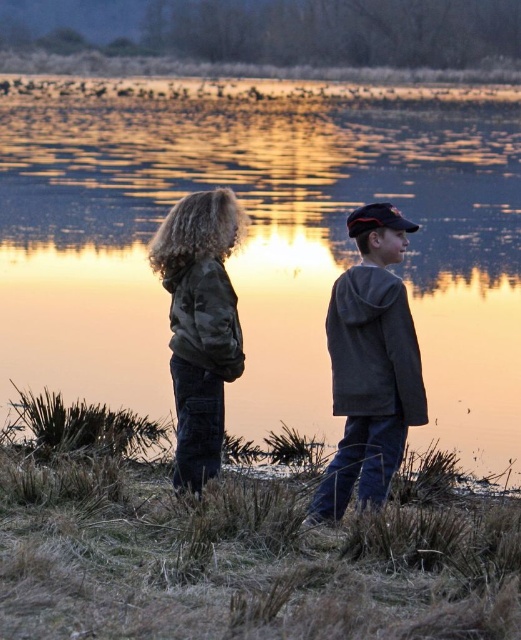
You are a photographer aiming to capture a clear shot of both the glistening water at center and the camo jacket at center. Since you want both elements in focus, which one should you adjust your camera focus on first to ensure the other remains sharp?

You should focus on the camo jacket at center first because it is farther away from the viewer than the glistening water at center. By focusing on the farther object, the closer object will naturally fall into the depth of field and remain sharp.